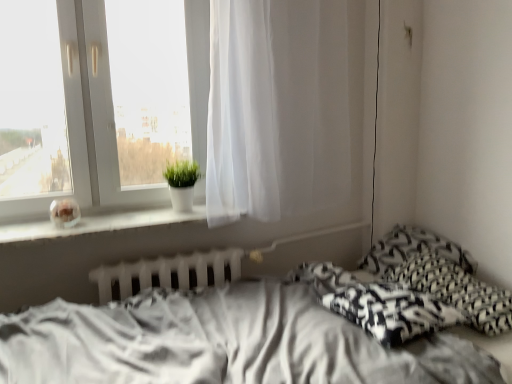
Question: Should I look upward or downward to see black printed pillow at right, the first pillow in the back-to-front sequence?

Choices:
 (A) down
 (B) up

Answer: (A)

Question: Could you tell me if white glossy vase at upper left is facing white matte window sill at left?

Choices:
 (A) no
 (B) yes

Answer: (A)

Question: Is white glossy vase at upper left positioned far away from white matte window sill at left?

Choices:
 (A) no
 (B) yes

Answer: (A)

Question: Can you confirm if white glossy vase at upper left is wider than white matte window sill at left?

Choices:
 (A) yes
 (B) no

Answer: (B)

Question: Is white glossy vase at upper left looking in the opposite direction of white matte window sill at left?

Choices:
 (A) no
 (B) yes

Answer: (A)

Question: Is white glossy vase at upper left placed right next to white matte window sill at left?

Choices:
 (A) no
 (B) yes

Answer: (A)

Question: Is white glossy vase at upper left taller than white matte window sill at left?

Choices:
 (A) yes
 (B) no

Answer: (A)

Question: From a real-world perspective, is green matte plant at window located beneath white glossy vase at upper left?

Choices:
 (A) no
 (B) yes

Answer: (B)

Question: Is white glossy vase at upper left at the back of green matte plant at window?

Choices:
 (A) no
 (B) yes

Answer: (B)

Question: Considering the relative positions of green matte plant at window and white glossy vase at upper left in the image provided, is green matte plant at window behind white glossy vase at upper left?

Choices:
 (A) yes
 (B) no

Answer: (A)

Question: Is green matte plant at window thinner than white glossy vase at upper left?

Choices:
 (A) no
 (B) yes

Answer: (A)

Question: Is the depth of green matte plant at window less than that of white glossy vase at upper left?

Choices:
 (A) no
 (B) yes

Answer: (A)

Question: Is green matte plant at window facing towards white glossy vase at upper left?

Choices:
 (A) no
 (B) yes

Answer: (A)

Question: Considering the relative sizes of white glossy vase at upper left and black printed pillow at right, which is the second pillow in front-to-back order, in the image provided, is white glossy vase at upper left bigger than black printed pillow at right, which is the second pillow in front-to-back order,?

Choices:
 (A) no
 (B) yes

Answer: (B)